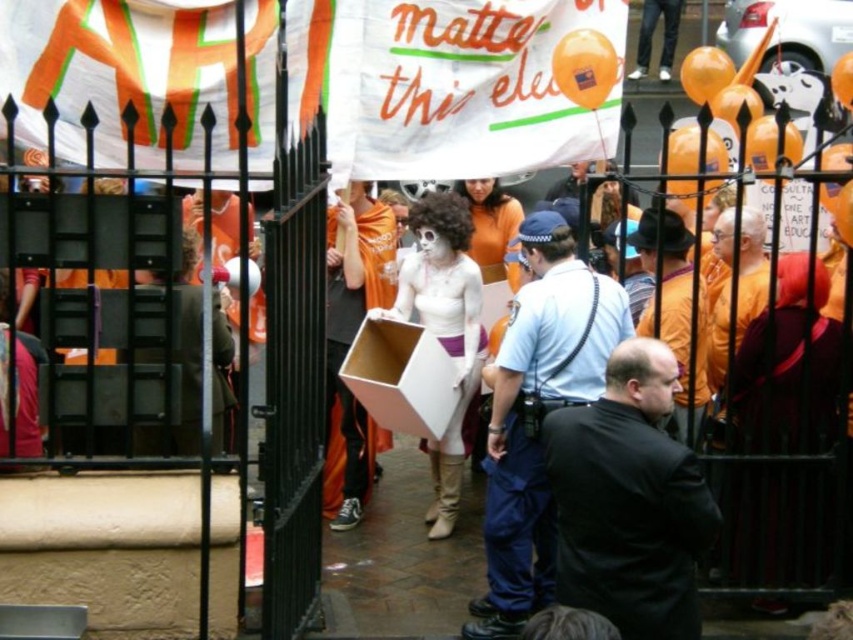
This screenshot has height=640, width=853. What do you see at coordinates (630, 500) in the screenshot?
I see `black matte jacket at center` at bounding box center [630, 500].

Who is more forward, (554, 480) or (492, 413)?

Point (554, 480) is more forward.

Identify the location of black matte jacket at center. The image size is (853, 640). (630, 500).

Between dark blue uniform at center and orange fabric shirt at center, which one is positioned lower?

dark blue uniform at center is below.

Can you confirm if dark blue uniform at center is positioned to the left of orange fabric shirt at center?

Correct, you'll find dark blue uniform at center to the left of orange fabric shirt at center.

Is point (569, 273) more distant than point (675, 269)?

No, (569, 273) is in front of (675, 269).

Locate an element on the screen. The width and height of the screenshot is (853, 640). dark blue uniform at center is located at coordinates (538, 413).

Does black matte jacket at center have a lesser width compared to orange fabric shirt at center?

No.

Image resolution: width=853 pixels, height=640 pixels. In order to click on black matte jacket at center in this screenshot , I will do 630,500.